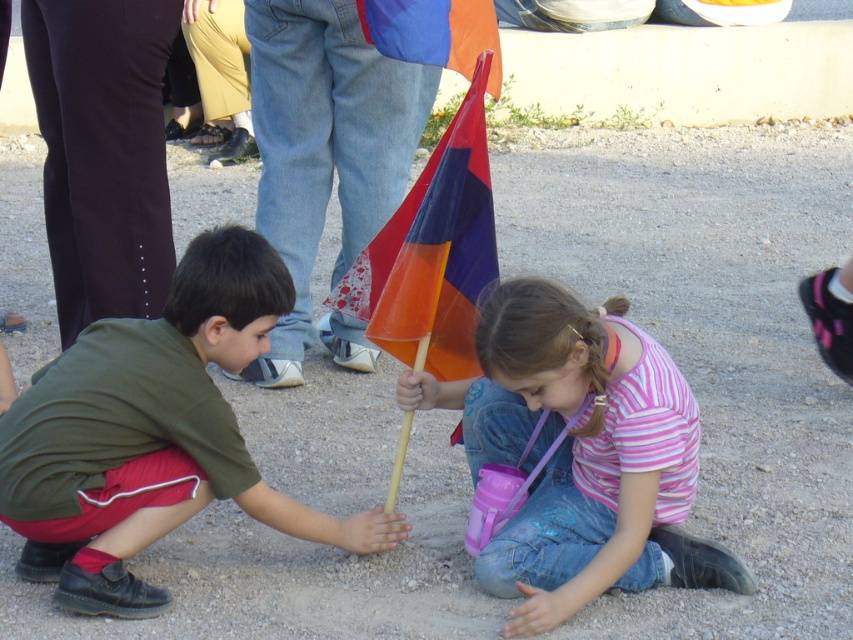
Where is the green matte shirt at lower left located in the image?

The green matte shirt at lower left is located at point (152, 435).

Based on the scene description, can you determine the spatial relationship between the pink striped shirt at center and the orange fabric flag at upper center?

The pink striped shirt at center is located to the right of the orange fabric flag at upper center.